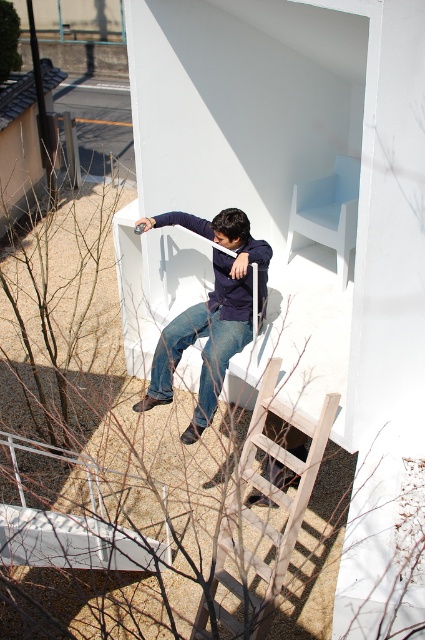
You are a delivery person trying to place a package on the available space between the blue denim jeans at lower center and the white matte chair at upper center. Can you estimate whether the package will fit there?

The blue denim jeans at lower center occupies less space than white matte chair at upper center, so the available space between them might be sufficient for the package, but the exact fit depends on the package size.

You are a painter standing on a wooden ladder at lower center. You want to reach the matte blue jeans at center to hand the person a paintbrush. Can you reach them from your current position on the ladder?

The matte blue jeans at center is positioned over wooden ladder at lower center, meaning the person wearing the jeans is above the ladder. Since you are on the ladder, you can reach them by extending your arm upwards.

You are a photographer standing near the camera. You want to capture a photo of the blue denim jeans at lower center. Can you reach the jeans within 5 meters without moving the camera?

The blue denim jeans at lower center and camera are 5.25 meters apart, so you cannot reach the jeans within 5 meters without moving the camera since the distance is greater than 5 meters.